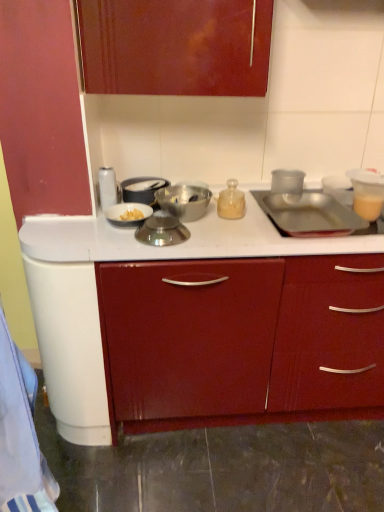
Measure the distance between metallic silver bowl at center, which ranks as the 5th kitchen appliance in right-to-left order, and camera.

5.10 feet.

The height and width of the screenshot is (512, 384). What do you see at coordinates (142, 189) in the screenshot? I see `metallic silver bowl at center, which ranks as the 5th kitchen appliance in right-to-left order` at bounding box center [142, 189].

What do you see at coordinates (128, 214) in the screenshot? I see `white glossy bowl at center left, the 6th kitchen appliance positioned from the right` at bounding box center [128, 214].

At what (x,y) coordinates should I click in order to perform the action: click on metallic silver sink at right. Please return your answer as a coordinate pair (x, y). Looking at the image, I should click on (308, 212).

The height and width of the screenshot is (512, 384). Describe the element at coordinates (231, 201) in the screenshot. I see `translucent glass jar at center, the second kitchen appliance positioned from the right` at that location.

Locate an element on the screen. The image size is (384, 512). metallic silver bowl at center, acting as the third kitchen appliance starting from the left is located at coordinates (142, 189).

Choose the correct answer: Is translucent glass jar at center, positioned as the sixth kitchen appliance in left-to-right order, inside translucent plastic cup at upper right or outside it?

translucent glass jar at center, positioned as the sixth kitchen appliance in left-to-right order, cannot be found inside translucent plastic cup at upper right.

Is translucent glass jar at center, positioned as the sixth kitchen appliance in left-to-right order, positioned with its back to translucent plastic cup at upper right?

No, translucent glass jar at center, positioned as the sixth kitchen appliance in left-to-right order, is not facing away from translucent plastic cup at upper right.

From the picture: Is translucent glass jar at center, the second kitchen appliance positioned from the right, bigger or smaller than translucent plastic cup at upper right?

Clearly, translucent glass jar at center, the second kitchen appliance positioned from the right, is smaller in size than translucent plastic cup at upper right.

How many degrees apart are the facing directions of translucent glass jar at center, the second kitchen appliance positioned from the right, and translucent plastic cup at upper right?

They differ by 3.9 degrees in their facing directions.

From a real-world perspective, is shiny metallic bowl at center, which is the 4th kitchen appliance from left to right, positioned above or below metallic silver bowl at center, acting as the third kitchen appliance starting from the left?

From a real-world perspective, shiny metallic bowl at center, which is the 4th kitchen appliance from left to right, is physically below metallic silver bowl at center, acting as the third kitchen appliance starting from the left.

Is shiny metallic bowl at center, which ranks as the 4th kitchen appliance in right-to-left order, oriented away from metallic silver bowl at center, which ranks as the 5th kitchen appliance in right-to-left order?

Correct, shiny metallic bowl at center, which ranks as the 4th kitchen appliance in right-to-left order, is looking away from metallic silver bowl at center, which ranks as the 5th kitchen appliance in right-to-left order.

Considering the sizes of objects shiny metallic bowl at center, which is the 4th kitchen appliance from left to right, and metallic silver bowl at center, which ranks as the 5th kitchen appliance in right-to-left order, in the image provided, who is shorter, shiny metallic bowl at center, which is the 4th kitchen appliance from left to right, or metallic silver bowl at center, which ranks as the 5th kitchen appliance in right-to-left order,?

With less height is shiny metallic bowl at center, which is the 4th kitchen appliance from left to right.

Can you confirm if shiny metallic bowl at center, which is the 4th kitchen appliance from left to right, is thinner than metallic silver bowl at center, acting as the third kitchen appliance starting from the left?

Indeed, shiny metallic bowl at center, which is the 4th kitchen appliance from left to right, has a lesser width compared to metallic silver bowl at center, acting as the third kitchen appliance starting from the left.

Between metallic silver bowl at center, which ranks as the 5th kitchen appliance in right-to-left order, and translucent plastic cup at upper right, which one is positioned in front?

Positioned in front is translucent plastic cup at upper right.

From a real-world perspective, which object rests below the other?

metallic silver bowl at center, which ranks as the 5th kitchen appliance in right-to-left order, is physically lower.

Does point (122, 188) come closer to viewer compared to point (355, 191)?

That is True.

Who is bigger, metallic silver bowl at center, which ranks as the 5th kitchen appliance in right-to-left order, or translucent plastic cup at upper right?

Bigger between the two is metallic silver bowl at center, which ranks as the 5th kitchen appliance in right-to-left order.

Does white glossy canister at upper left, which is counted as the first kitchen appliance, starting from the left, have a greater width compared to metallic bowl at center, the 3th kitchen appliance viewed from the right?

Incorrect, the width of white glossy canister at upper left, which is counted as the first kitchen appliance, starting from the left, does not surpass that of metallic bowl at center, the 3th kitchen appliance viewed from the right.

At what (x,y) coordinates should I click in order to perform the action: click on the 2nd kitchen appliance below the white glossy canister at upper left, which is counted as the first kitchen appliance, starting from the left (from the image's perspective). Please return your answer as a coordinate pair (x, y). Looking at the image, I should click on (184, 201).

Can you tell me how much white glossy canister at upper left, which is counted as the first kitchen appliance, starting from the left, and metallic bowl at center, the 3th kitchen appliance viewed from the right, differ in facing direction?

The angle between the facing direction of white glossy canister at upper left, which is counted as the first kitchen appliance, starting from the left, and the facing direction of metallic bowl at center, the 3th kitchen appliance viewed from the right, is 1.87 degrees.

Consider the image. Is white glossy canister at upper left, which is the 7th kitchen appliance in right-to-left order, positioned far away from metallic bowl at center, which is the fifth kitchen appliance in left-to-right order?

No.

Which is more to the right, shiny metallic bowl at center, which is the 4th kitchen appliance from left to right, or white glossy canister at upper left, which is the 7th kitchen appliance in right-to-left order?

Positioned to the right is shiny metallic bowl at center, which is the 4th kitchen appliance from left to right.

Between point (174, 225) and point (107, 183), which one is positioned in front?

Positioned in front is point (174, 225).

Is shiny metallic bowl at center, which ranks as the 4th kitchen appliance in right-to-left order, facing towards white glossy canister at upper left, which is counted as the first kitchen appliance, starting from the left?

No, shiny metallic bowl at center, which ranks as the 4th kitchen appliance in right-to-left order, is not turned towards white glossy canister at upper left, which is counted as the first kitchen appliance, starting from the left.

From a real-world perspective, is shiny metallic bowl at center, which is the 4th kitchen appliance from left to right, positioned above or below white glossy canister at upper left, which is counted as the first kitchen appliance, starting from the left?

shiny metallic bowl at center, which is the 4th kitchen appliance from left to right, is situated lower than white glossy canister at upper left, which is counted as the first kitchen appliance, starting from the left, in the real world.

Does point (182, 206) come farther from viewer compared to point (274, 186)?

No, (182, 206) is in front of (274, 186).

Based on the photo, which is more to the left, metallic bowl at center, which is the fifth kitchen appliance in left-to-right order, or transparent plastic cup at upper right, which ranks as the 1th kitchen appliance in right-to-left order?

metallic bowl at center, which is the fifth kitchen appliance in left-to-right order, is more to the left.

Is transparent plastic cup at upper right, which ranks as the 1th kitchen appliance in right-to-left order, bigger or smaller than translucent glass jar at center, the second kitchen appliance positioned from the right?

Considering their sizes, transparent plastic cup at upper right, which ranks as the 1th kitchen appliance in right-to-left order, takes up more space than translucent glass jar at center, the second kitchen appliance positioned from the right.

From the image's perspective, between transparent plastic cup at upper right, the seventh kitchen appliance in the left-to-right sequence, and translucent glass jar at center, positioned as the sixth kitchen appliance in left-to-right order, which one is located above?

transparent plastic cup at upper right, the seventh kitchen appliance in the left-to-right sequence, is shown above in the image.

Does transparent plastic cup at upper right, the seventh kitchen appliance in the left-to-right sequence, have a lesser height compared to translucent glass jar at center, positioned as the sixth kitchen appliance in left-to-right order?

Incorrect, the height of transparent plastic cup at upper right, the seventh kitchen appliance in the left-to-right sequence, does not fall short of that of translucent glass jar at center, positioned as the sixth kitchen appliance in left-to-right order.

You are a GUI agent. You are given a task and a screenshot of the screen. Output one action in this format:
    pyautogui.click(x=<x>, y=<y>)
    Task: Click on the kitchen appliance that is the 1st object located above the translucent plastic cup at upper right (from the image's perspective)
    The width and height of the screenshot is (384, 512).
    Given the screenshot: What is the action you would take?
    pyautogui.click(x=231, y=201)

Find the location of a particular element. the 5th kitchen appliance behind the shiny metallic bowl at center, which ranks as the 4th kitchen appliance in right-to-left order is located at coordinates (142, 189).

Estimate the real-world distances between objects in this image. Which object is closer to metallic silver bowl at center, which ranks as the 5th kitchen appliance in right-to-left order, translucent plastic cup at upper right or metallic silver sink at right?

Among the two, metallic silver sink at right is located nearer to metallic silver bowl at center, which ranks as the 5th kitchen appliance in right-to-left order.

From the picture: From the image, which object appears to be nearer to transparent plastic cup at upper right, the seventh kitchen appliance in the left-to-right sequence, white glossy bowl at center left, the 6th kitchen appliance positioned from the right, or shiny metallic bowl at center, which ranks as the 4th kitchen appliance in right-to-left order?

The object closer to transparent plastic cup at upper right, the seventh kitchen appliance in the left-to-right sequence, is shiny metallic bowl at center, which ranks as the 4th kitchen appliance in right-to-left order.

From the image, which object appears to be farther from transparent plastic cup at upper right, which ranks as the 1th kitchen appliance in right-to-left order, white glossy canister at upper left, which is counted as the first kitchen appliance, starting from the left, or shiny metallic bowl at center, which ranks as the 4th kitchen appliance in right-to-left order?

Among the two, white glossy canister at upper left, which is counted as the first kitchen appliance, starting from the left, is located further to transparent plastic cup at upper right, which ranks as the 1th kitchen appliance in right-to-left order.

Considering their positions, is shiny metallic bowl at center, which is the 4th kitchen appliance from left to right, positioned further to metallic silver sink at right than translucent plastic cup at upper right?

shiny metallic bowl at center, which is the 4th kitchen appliance from left to right, is further to metallic silver sink at right.

Estimate the real-world distances between objects in this image. Which object is further from translucent plastic cup at upper right, metallic silver sink at right or white glossy canister at upper left, which is counted as the first kitchen appliance, starting from the left?

white glossy canister at upper left, which is counted as the first kitchen appliance, starting from the left, is further to translucent plastic cup at upper right.

When comparing their distances from shiny metallic bowl at center, which is the 4th kitchen appliance from left to right, does translucent glass jar at center, the second kitchen appliance positioned from the right, or transparent plastic cup at upper right, the seventh kitchen appliance in the left-to-right sequence, seem further?

transparent plastic cup at upper right, the seventh kitchen appliance in the left-to-right sequence.

Considering their positions, is shiny metallic bowl at center, which ranks as the 4th kitchen appliance in right-to-left order, positioned closer to translucent glass jar at center, the second kitchen appliance positioned from the right, than translucent plastic cup at upper right?

Among the two, shiny metallic bowl at center, which ranks as the 4th kitchen appliance in right-to-left order, is located nearer to translucent glass jar at center, the second kitchen appliance positioned from the right.

From the image, which object appears to be farther from shiny metallic bowl at center, which is the 4th kitchen appliance from left to right, metallic silver bowl at center, which ranks as the 5th kitchen appliance in right-to-left order, or white glossy canister at upper left, which is counted as the first kitchen appliance, starting from the left?

white glossy canister at upper left, which is counted as the first kitchen appliance, starting from the left, lies further to shiny metallic bowl at center, which is the 4th kitchen appliance from left to right, than the other object.

Find the location of a particular element. sink between metallic silver bowl at center, which ranks as the 5th kitchen appliance in right-to-left order, and translucent plastic cup at upper right, in the horizontal direction is located at coordinates (308, 212).

Locate an element on the screen. This screenshot has width=384, height=512. sink between metallic bowl at center, the 3th kitchen appliance viewed from the right, and translucent plastic cup at upper right is located at coordinates (308, 212).

Identify the location of sink situated between shiny metallic bowl at center, which is the 4th kitchen appliance from left to right, and translucent plastic cup at upper right from left to right. This screenshot has width=384, height=512. (308, 212).

Locate an element on the screen. The width and height of the screenshot is (384, 512). appliance between metallic silver sink at right and transparent plastic cup at upper right, which ranks as the 1th kitchen appliance in right-to-left order, along the z-axis is located at coordinates (367, 192).